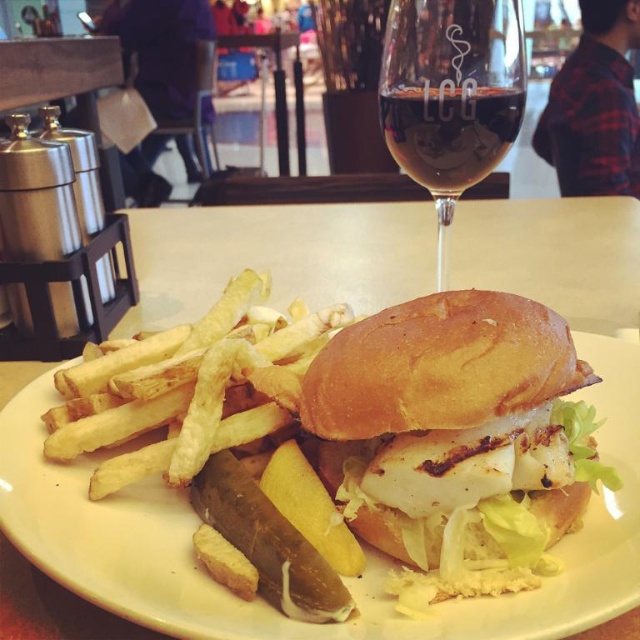
Measure the distance between point (x=225, y=419) and camera.

Point (x=225, y=419) is 24.14 inches from camera.

Is golden crispy french fries at lower left closer to camera compared to transparent glass at upper center?

Yes, golden crispy french fries at lower left is in front of transparent glass at upper center.

Where is `golden crispy french fries at lower left`? The image size is (640, 640). golden crispy french fries at lower left is located at coordinates (195, 397).

Does white bread bun at center appear on the right side of transparent glass wine at upper center?

No, white bread bun at center is not to the right of transparent glass wine at upper center.

Who is taller, white bread bun at center or transparent glass wine at upper center?

Standing taller between the two is transparent glass wine at upper center.

Does point (442, 342) lie behind point (378, 97)?

No, it is in front of (378, 97).

Image resolution: width=640 pixels, height=640 pixels. Find the location of `white bread bun at center`. white bread bun at center is located at coordinates (448, 424).

Does slightly toasted bun at center have a larger size compared to golden crispy french fries at lower left?

Correct, slightly toasted bun at center is larger in size than golden crispy french fries at lower left.

Describe the element at coordinates (346, 579) in the screenshot. I see `slightly toasted bun at center` at that location.

Image resolution: width=640 pixels, height=640 pixels. In order to click on slightly toasted bun at center in this screenshot , I will do `click(346, 579)`.